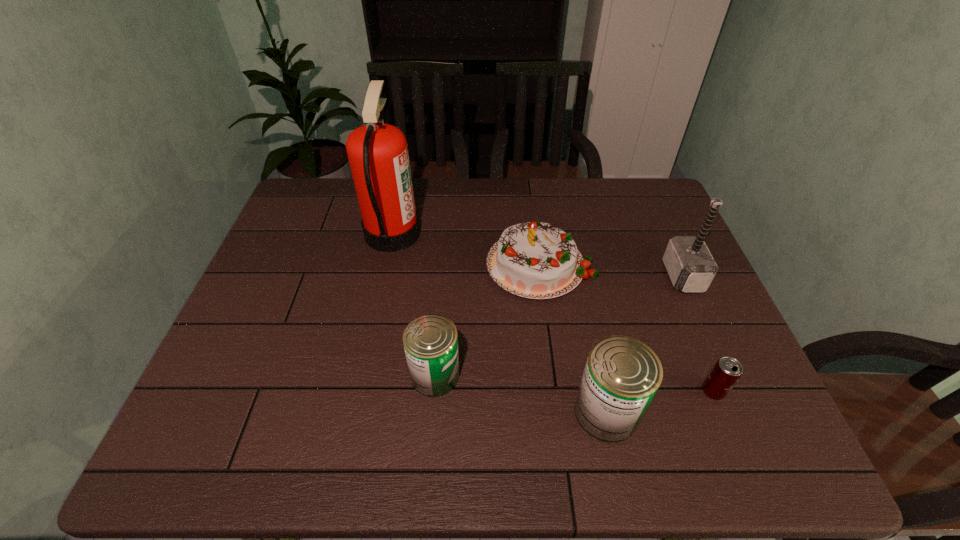
Identify the location of free space that satisfies the following two spatial constraints: 1. at the nozzle of the tallest object; 2. on the right side of the shorter can. The image size is (960, 540). (363, 375).

At what (x,y) coordinates should I click in order to perform the action: click on vacant space that satisfies the following two spatial constraints: 1. on the back side of the cake; 2. on the left side of the fifth object from right to left. Please return your answer as a coordinate pair (x, y). Image resolution: width=960 pixels, height=540 pixels. Looking at the image, I should click on (444, 264).

Where is `free space that satisfies the following two spatial constraints: 1. on the back side of the shorter can; 2. at the nozzle of the leftmost object`? free space that satisfies the following two spatial constraints: 1. on the back side of the shorter can; 2. at the nozzle of the leftmost object is located at coordinates (446, 233).

Identify the location of vacant space that satisfies the following two spatial constraints: 1. at the nozzle of the right can; 2. on the right side of the fire extinguisher. (355, 412).